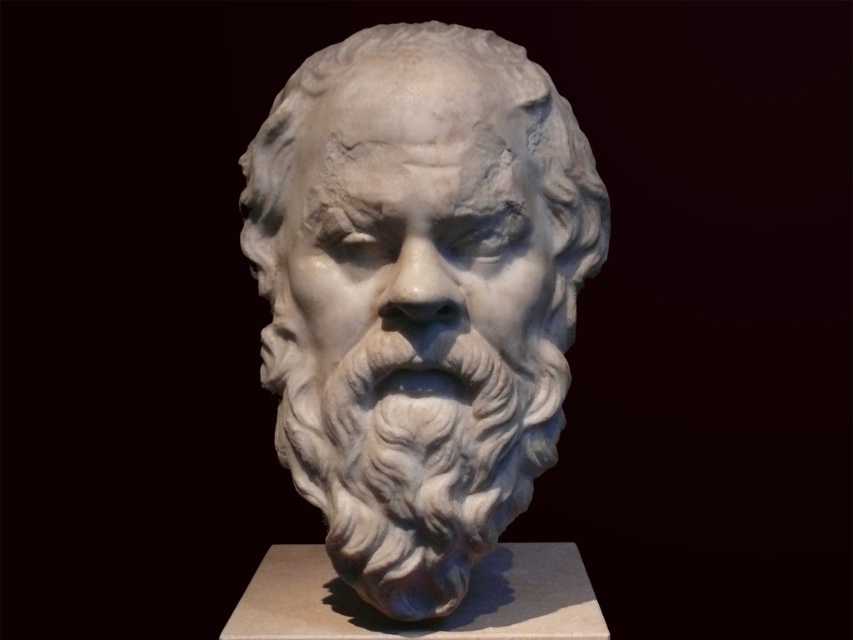
Which of these two, white marble bust at center or white marble face at center, stands shorter?

Standing shorter between the two is white marble face at center.

Does white marble bust at center appear over white marble face at center?

Incorrect, white marble bust at center is not positioned above white marble face at center.

Between point (515, 227) and point (337, 163), which one is positioned behind?

Positioned behind is point (515, 227).

You are a GUI agent. You are given a task and a screenshot of the screen. Output one action in this format:
    pyautogui.click(x=<x>, y=<y>)
    Task: Click on the white marble bust at center
    
    Given the screenshot: What is the action you would take?
    pyautogui.click(x=418, y=294)